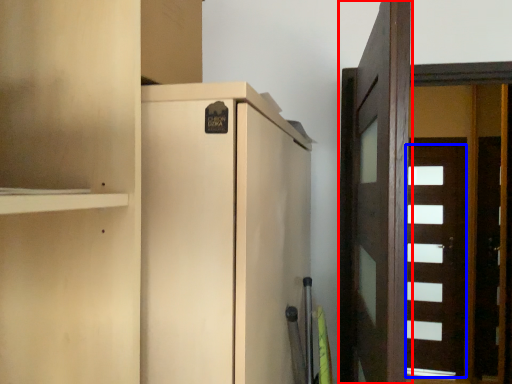
Question: Among these objects, which one is nearest to the camera, door (highlighted by a red box) or door (highlighted by a blue box)?

Choices:
 (A) door
 (B) door

Answer: (A)